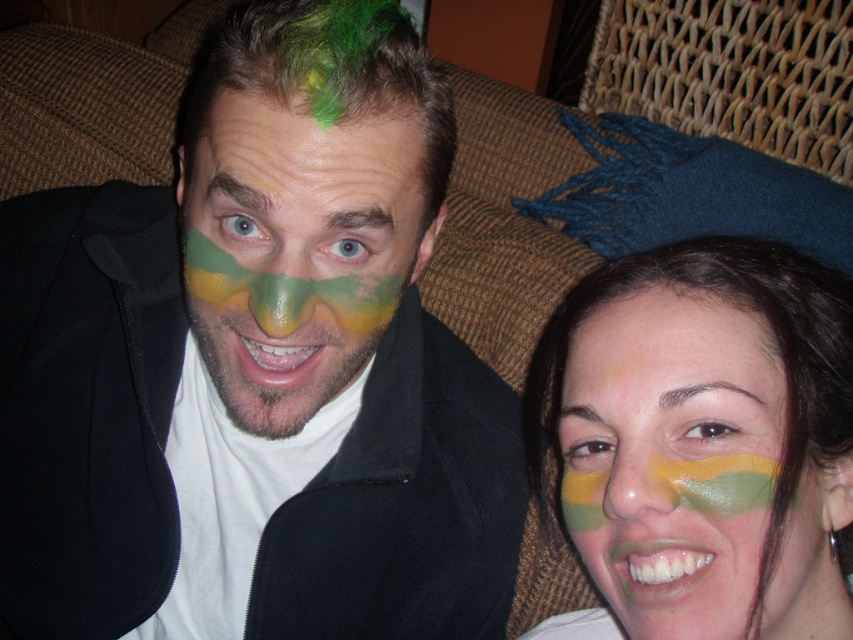
Looking at this image, does matte black jacket at center have a lesser width compared to green matte paint at center?

Incorrect, matte black jacket at center's width is not less than green matte paint at center's.

Is point (216, 84) closer to camera compared to point (306, 333)?

No, it is not.

What are the coordinates of `matte black jacket at center` in the screenshot? It's located at (259, 355).

This screenshot has width=853, height=640. Find the location of `green matte paint at lower right`. green matte paint at lower right is located at coordinates (672, 458).

Does green matte paint at lower right have a lesser height compared to green matte paint at center?

Yes, green matte paint at lower right is shorter than green matte paint at center.

At what (x,y) coordinates should I click in order to perform the action: click on green matte paint at lower right. Please return your answer as a coordinate pair (x, y). The height and width of the screenshot is (640, 853). Looking at the image, I should click on (672, 458).

Does matte black jacket at center have a lesser width compared to green matte paint at lower right?

No.

In order to click on matte black jacket at center in this screenshot , I will do `click(259, 355)`.

Locate an element on the screen. matte black jacket at center is located at coordinates (259, 355).

I want to click on matte black jacket at center, so click(259, 355).